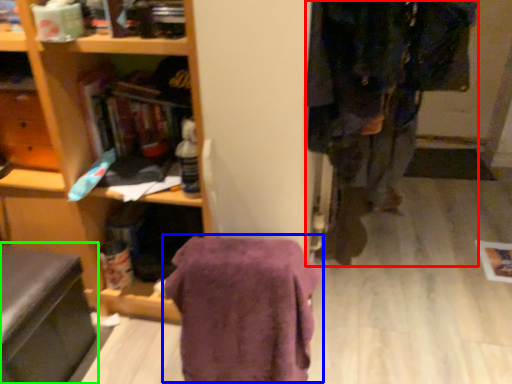
Question: Considering the real-world distances, which object is closest to clothing (highlighted by a red box)? blanket (highlighted by a blue box) or swivel chair (highlighted by a green box).

Choices:
 (A) blanket
 (B) swivel chair

Answer: (A)